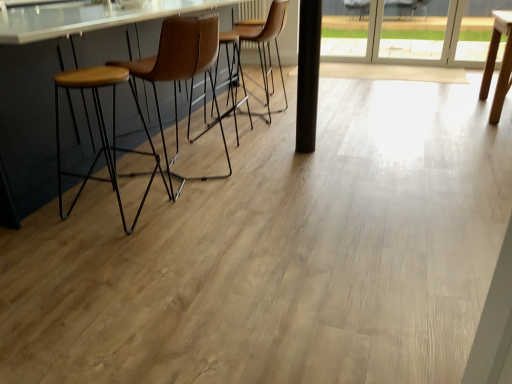
Where is `free space in front of transparent glass screen door at upper right`? free space in front of transparent glass screen door at upper right is located at coordinates (418, 64).